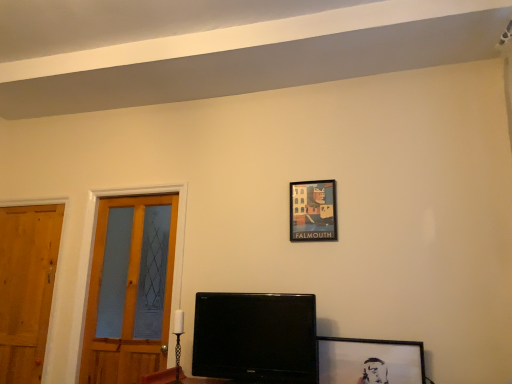
This screenshot has width=512, height=384. What are the coordinates of `wooden door at left, the second door viewed from the right` in the screenshot? It's located at (26, 287).

The width and height of the screenshot is (512, 384). I want to click on matte paper picture frame at upper center, the second picture frame ordered from the bottom, so click(313, 211).

Image resolution: width=512 pixels, height=384 pixels. I want to click on wooden door at left, which appears as the 1th door when viewed from the right, so click(131, 288).

The width and height of the screenshot is (512, 384). What do you see at coordinates (131, 288) in the screenshot? I see `wooden door at left, placed as the 2th door when sorted from left to right` at bounding box center [131, 288].

This screenshot has height=384, width=512. Identify the location of black glossy monitor at center. (256, 338).

This screenshot has width=512, height=384. What do you see at coordinates (370, 361) in the screenshot?
I see `black matte picture frame at lower right, the 2th picture frame positioned from the back` at bounding box center [370, 361].

At what (x,y) coordinates should I click in order to perform the action: click on wooden door at left, the second door viewed from the right. Please return your answer as a coordinate pair (x, y). This screenshot has width=512, height=384. Looking at the image, I should click on click(26, 287).

How different are the orientations of black matte picture frame at lower right, which is the first picture frame from front to back, and matte paper picture frame at upper center, the first picture frame from the top, in degrees?

There is a 0.436-degree angle between the facing directions of black matte picture frame at lower right, which is the first picture frame from front to back, and matte paper picture frame at upper center, the first picture frame from the top.

Find the location of a particular element. The width and height of the screenshot is (512, 384). picture frame below the matte paper picture frame at upper center, the second picture frame ordered from the bottom (from the image's perspective) is located at coordinates (370, 361).

Is black matte picture frame at lower right, which is the first picture frame from front to back, spatially inside matte paper picture frame at upper center, the 2th picture frame in the front-to-back sequence, or outside of it?

The correct answer is: outside.

From the picture: From a real-world perspective, relative to matte paper picture frame at upper center, the second picture frame ordered from the bottom, is black matte picture frame at lower right, which is the first picture frame from front to back, vertically above or below?

Clearly, from a real-world perspective, black matte picture frame at lower right, which is the first picture frame from front to back, is below matte paper picture frame at upper center, the second picture frame ordered from the bottom.

From the picture: From a real-world perspective, which object stands above the other?

In real-world perspective, matte paper picture frame at upper center, the second picture frame ordered from the bottom, is above.

Is matte paper picture frame at upper center, the second picture frame ordered from the bottom, far from black glossy monitor at center?

No, matte paper picture frame at upper center, the second picture frame ordered from the bottom, is not far from black glossy monitor at center.

You are a GUI agent. You are given a task and a screenshot of the screen. Output one action in this format:
    pyautogui.click(x=<x>, y=<y>)
    Task: Click on the computer monitor lying in front of the matte paper picture frame at upper center, the first picture frame from the back
    The image size is (512, 384).
    Given the screenshot: What is the action you would take?
    pyautogui.click(x=256, y=338)

Which object is positioned more to the left, matte paper picture frame at upper center, the second picture frame ordered from the bottom, or black glossy monitor at center?

From the viewer's perspective, black glossy monitor at center appears more on the left side.

Is wooden door at left, placed as the 2th door when sorted from left to right, wider or thinner than black matte picture frame at lower right, placed as the 1th picture frame when sorted from bottom to top?

In the image, wooden door at left, placed as the 2th door when sorted from left to right, appears to be wider than black matte picture frame at lower right, placed as the 1th picture frame when sorted from bottom to top.

Between point (117, 367) and point (330, 367), which one is positioned behind?

The point (117, 367) is farther.

In the scene shown: Can we say wooden door at left, which appears as the 1th door when viewed from the right, lies outside black matte picture frame at lower right, the 2th picture frame positioned from the back?

That's correct, wooden door at left, which appears as the 1th door when viewed from the right, is outside of black matte picture frame at lower right, the 2th picture frame positioned from the back.

Is wooden door at left, which appears as the 1th door when viewed from the right, aimed at black matte picture frame at lower right, the 2th picture frame positioned from the back?

No, wooden door at left, which appears as the 1th door when viewed from the right, does not turn towards black matte picture frame at lower right, the 2th picture frame positioned from the back.

Is black glossy monitor at center facing away from wooden door at left, placed as the 2th door when sorted from left to right?

black glossy monitor at center is not turned away from wooden door at left, placed as the 2th door when sorted from left to right.

From the image's perspective, would you say black glossy monitor at center is shown under wooden door at left, which appears as the 1th door when viewed from the right?

Correct, black glossy monitor at center appears lower than wooden door at left, which appears as the 1th door when viewed from the right, in the image.

Who is shorter, black glossy monitor at center or wooden door at left, which appears as the 1th door when viewed from the right?

black glossy monitor at center.

Looking at this image, is wooden door at left, the second door viewed from the right, aimed at wooden door at left, placed as the 2th door when sorted from left to right?

No, wooden door at left, the second door viewed from the right, is not turned towards wooden door at left, placed as the 2th door when sorted from left to right.

Can you tell me how much wooden door at left, positioned as the first door in left-to-right order, and wooden door at left, placed as the 2th door when sorted from left to right, differ in facing direction?

There is a 0.692-degree angle between the facing directions of wooden door at left, positioned as the first door in left-to-right order, and wooden door at left, placed as the 2th door when sorted from left to right.

Which object is further away from the camera, wooden door at left, positioned as the first door in left-to-right order, or wooden door at left, placed as the 2th door when sorted from left to right?

wooden door at left, positioned as the first door in left-to-right order.

Would you say wooden door at left, the second door viewed from the right, contains wooden door at left, placed as the 2th door when sorted from left to right?

Result: No, wooden door at left, placed as the 2th door when sorted from left to right, is not surrounded by wooden door at left, the second door viewed from the right.

In the scene shown: Is matte paper picture frame at upper center, the second picture frame ordered from the bottom, wider or thinner than black matte picture frame at lower right, placed as the 1th picture frame when sorted from bottom to top?

In the image, matte paper picture frame at upper center, the second picture frame ordered from the bottom, appears to be more narrow than black matte picture frame at lower right, placed as the 1th picture frame when sorted from bottom to top.

Would you say matte paper picture frame at upper center, the second picture frame ordered from the bottom, is inside or outside black matte picture frame at lower right, which appears as the second picture frame when viewed from the top?

matte paper picture frame at upper center, the second picture frame ordered from the bottom, cannot be found inside black matte picture frame at lower right, which appears as the second picture frame when viewed from the top.

From a real-world perspective, is matte paper picture frame at upper center, the first picture frame from the back, on black matte picture frame at lower right, which is the first picture frame from front to back?

Yes, from a real-world perspective, matte paper picture frame at upper center, the first picture frame from the back, is over black matte picture frame at lower right, which is the first picture frame from front to back

Which object is closer to the camera taking this photo, matte paper picture frame at upper center, the first picture frame from the top, or black matte picture frame at lower right, which appears as the second picture frame when viewed from the top?

black matte picture frame at lower right, which appears as the second picture frame when viewed from the top.

Is matte paper picture frame at upper center, the first picture frame from the top, in front of wooden door at left, which appears as the 1th door when viewed from the right?

Yes.

Considering the relative sizes of matte paper picture frame at upper center, the 2th picture frame in the front-to-back sequence, and wooden door at left, which appears as the 1th door when viewed from the right, in the image provided, is matte paper picture frame at upper center, the 2th picture frame in the front-to-back sequence, bigger than wooden door at left, which appears as the 1th door when viewed from the right,?

Incorrect, matte paper picture frame at upper center, the 2th picture frame in the front-to-back sequence, is not larger than wooden door at left, which appears as the 1th door when viewed from the right.

From the picture: Does matte paper picture frame at upper center, the 2th picture frame in the front-to-back sequence, turn towards wooden door at left, placed as the 2th door when sorted from left to right?

No, matte paper picture frame at upper center, the 2th picture frame in the front-to-back sequence, is not turned towards wooden door at left, placed as the 2th door when sorted from left to right.

Find the location of `picture frame positioned vertically above the black matte picture frame at lower right, placed as the 1th picture frame when sorted from bottom to top (from a real-world perspective)`. picture frame positioned vertically above the black matte picture frame at lower right, placed as the 1th picture frame when sorted from bottom to top (from a real-world perspective) is located at coordinates (313, 211).

Which picture frame is the 1st one when counting from the right side of the black glossy monitor at center? Please provide its 2D coordinates.

[(313, 211)]

When comparing their distances from matte paper picture frame at upper center, the 2th picture frame in the front-to-back sequence, does black glossy monitor at center or wooden door at left, the second door viewed from the right, seem further?

wooden door at left, the second door viewed from the right, lies further to matte paper picture frame at upper center, the 2th picture frame in the front-to-back sequence, than the other object.

Which object lies nearer to the anchor point black glossy monitor at center, wooden door at left, placed as the 2th door when sorted from left to right, or wooden door at left, positioned as the first door in left-to-right order?

The object closer to black glossy monitor at center is wooden door at left, placed as the 2th door when sorted from left to right.

Considering their positions, is matte paper picture frame at upper center, the first picture frame from the top, positioned further to wooden door at left, positioned as the first door in left-to-right order, than black glossy monitor at center?

matte paper picture frame at upper center, the first picture frame from the top.

When comparing their distances from wooden door at left, the second door viewed from the right, does matte paper picture frame at upper center, the first picture frame from the top, or black matte picture frame at lower right, which is the first picture frame from front to back, seem closer?

matte paper picture frame at upper center, the first picture frame from the top, is positioned closer to the anchor wooden door at left, the second door viewed from the right.

Looking at the image, which one is located closer to wooden door at left, placed as the 2th door when sorted from left to right, wooden door at left, positioned as the first door in left-to-right order, or matte paper picture frame at upper center, the first picture frame from the top?

wooden door at left, positioned as the first door in left-to-right order, is positioned closer to the anchor wooden door at left, placed as the 2th door when sorted from left to right.

From the image, which object appears to be nearer to wooden door at left, positioned as the first door in left-to-right order, wooden door at left, which appears as the 1th door when viewed from the right, or matte paper picture frame at upper center, the first picture frame from the back?

Among the two, wooden door at left, which appears as the 1th door when viewed from the right, is located nearer to wooden door at left, positioned as the first door in left-to-right order.

Looking at the image, which one is located further to wooden door at left, the second door viewed from the right, wooden door at left, which appears as the 1th door when viewed from the right, or black matte picture frame at lower right, which appears as the second picture frame when viewed from the top?

black matte picture frame at lower right, which appears as the second picture frame when viewed from the top.

Which object lies further to the anchor point wooden door at left, the second door viewed from the right, black glossy monitor at center or wooden door at left, placed as the 2th door when sorted from left to right?

black glossy monitor at center lies further to wooden door at left, the second door viewed from the right, than the other object.

Where is `computer monitor between wooden door at left, positioned as the first door in left-to-right order, and matte paper picture frame at upper center, the second picture frame ordered from the bottom`? computer monitor between wooden door at left, positioned as the first door in left-to-right order, and matte paper picture frame at upper center, the second picture frame ordered from the bottom is located at coordinates (256, 338).

At what (x,y) coordinates should I click in order to perform the action: click on picture frame between wooden door at left, placed as the 2th door when sorted from left to right, and black matte picture frame at lower right, which is the first picture frame from front to back, in the horizontal direction. Please return your answer as a coordinate pair (x, y). This screenshot has height=384, width=512. Looking at the image, I should click on click(313, 211).

At what (x,y) coordinates should I click in order to perform the action: click on door between wooden door at left, positioned as the first door in left-to-right order, and black glossy monitor at center. Please return your answer as a coordinate pair (x, y). This screenshot has height=384, width=512. Looking at the image, I should click on (131, 288).

Locate an element on the screen. The width and height of the screenshot is (512, 384). door located between wooden door at left, the second door viewed from the right, and black matte picture frame at lower right, placed as the 1th picture frame when sorted from bottom to top, in the left-right direction is located at coordinates (131, 288).